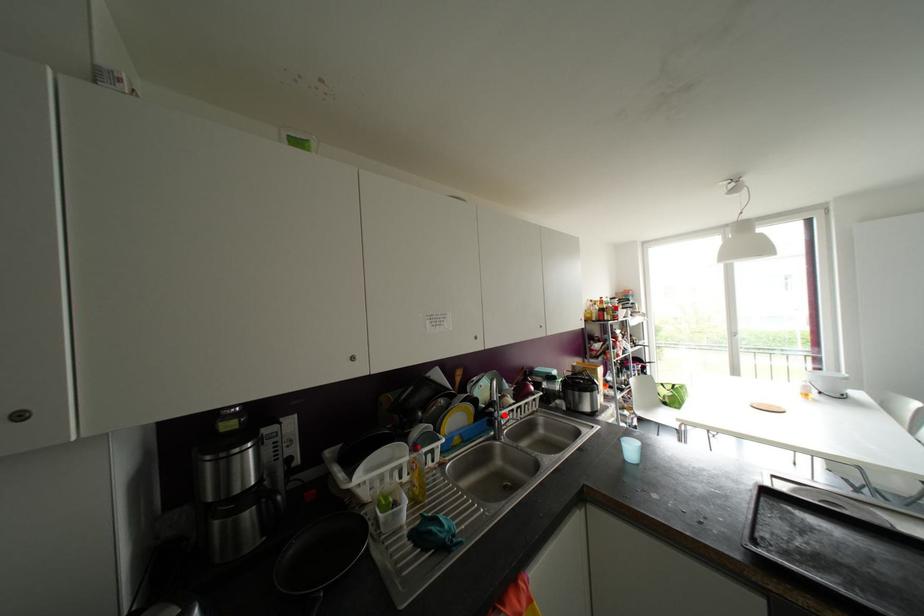
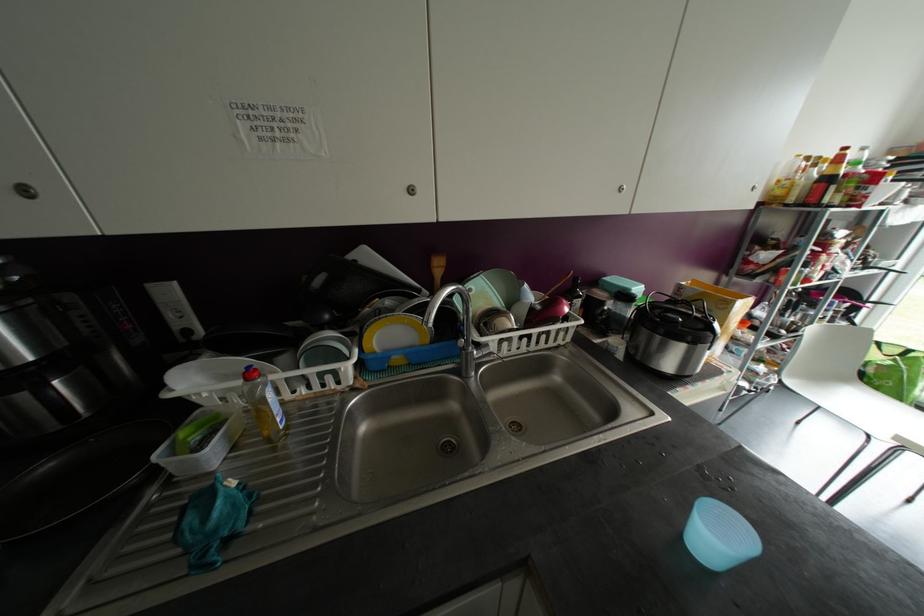
Question: I am providing you with two images of the same scene from different viewpoints. A red point is marked on the first image. Is the red point's position out of view in image 2?

Choices:
 (A) Yes
 (B) No

Answer: (B)